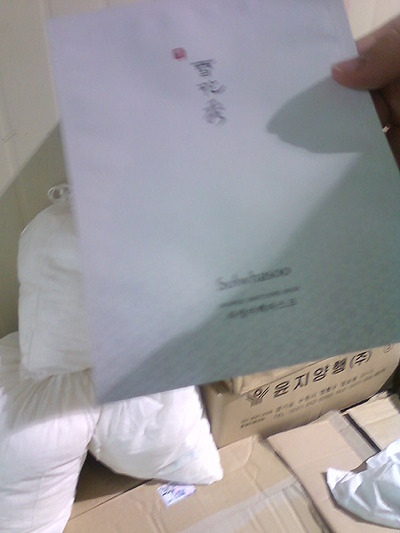
You are a GUI agent. You are given a task and a screenshot of the screen. Output one action in this format:
    pyautogui.click(x=<x>, y=<y>)
    Task: Click on the wall
    
    Given the screenshot: What is the action you would take?
    pyautogui.click(x=29, y=83)